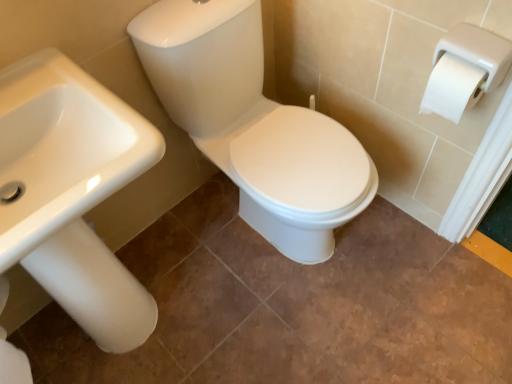
Where is `free space to the right of white glossy toilet seat at center`? The image size is (512, 384). free space to the right of white glossy toilet seat at center is located at coordinates (423, 266).